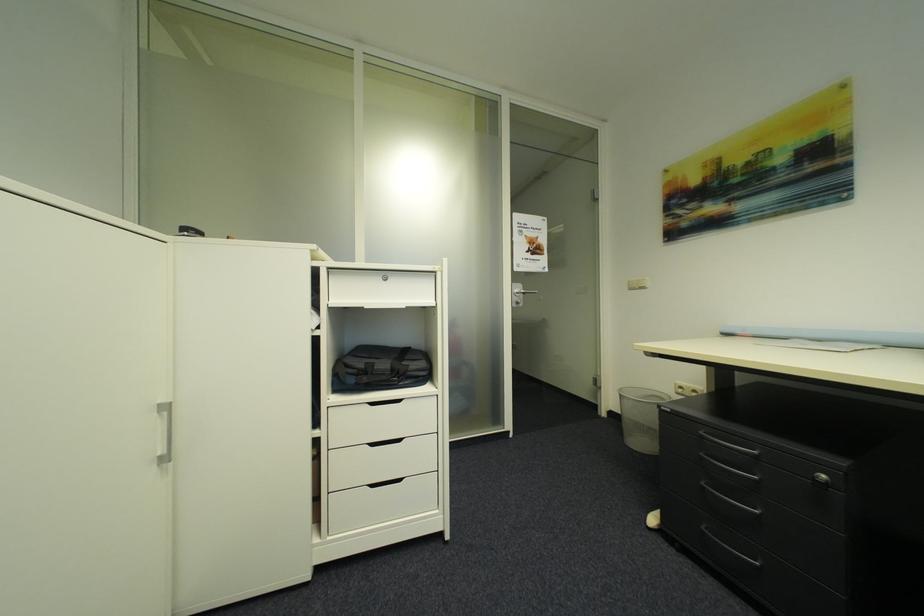
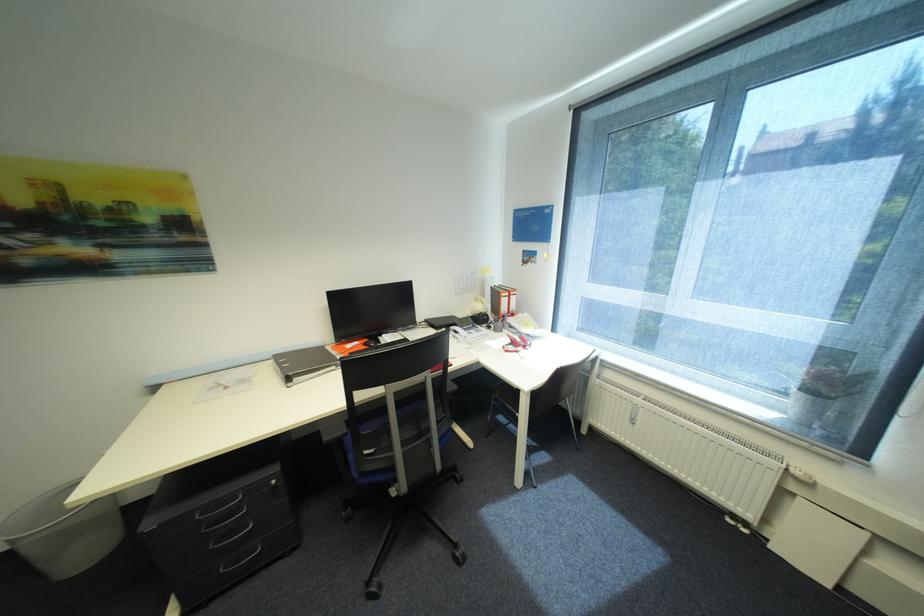
The images are taken continuously from a first-person perspective. In which direction is your viewpoint rotating?

The rotation direction of the camera is right-down.